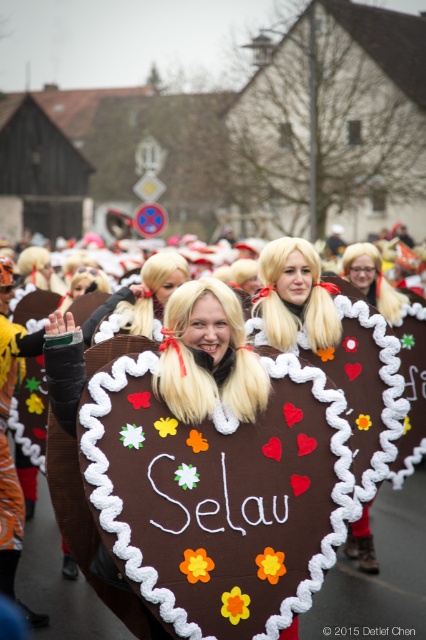
Is brown cardboard heart at center wider than blonde wig at center?

Indeed, brown cardboard heart at center has a greater width compared to blonde wig at center.

The width and height of the screenshot is (426, 640). What are the coordinates of `brown cardboard heart at center` in the screenshot? It's located at click(380, 570).